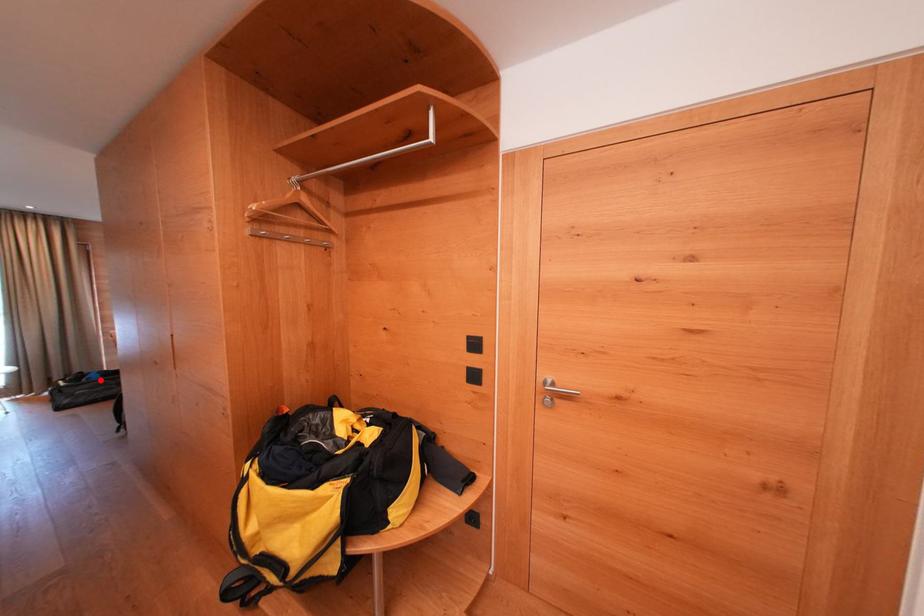
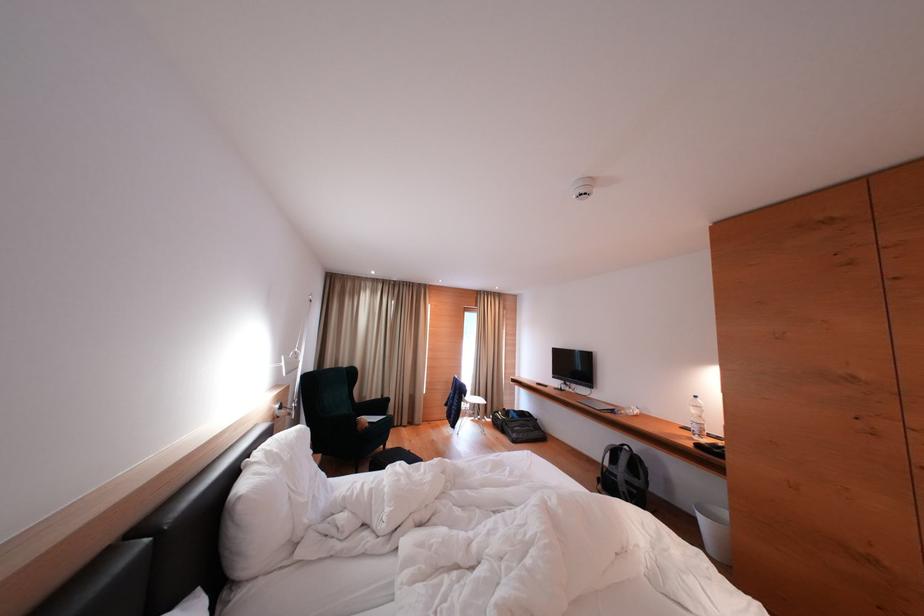
Question: I am providing you with two images of the same scene from different viewpoints. Image1 has a red point marked. In image2, the corresponding 3D location appears at what relative position? Reply with the corresponding letter.

Choices:
 (A) Closer
 (B) Farther

Answer: (B)